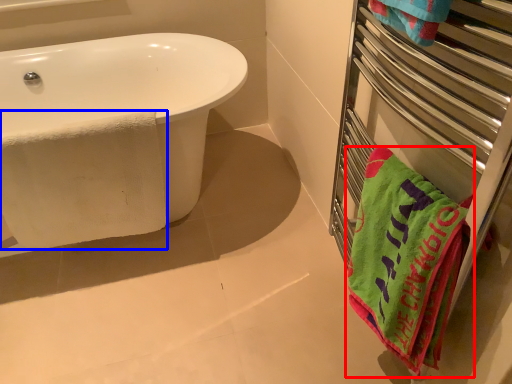
Question: Which object is further to the camera taking this photo, towel (highlighted by a red box) or beach towel (highlighted by a blue box)?

Choices:
 (A) towel
 (B) beach towel

Answer: (B)